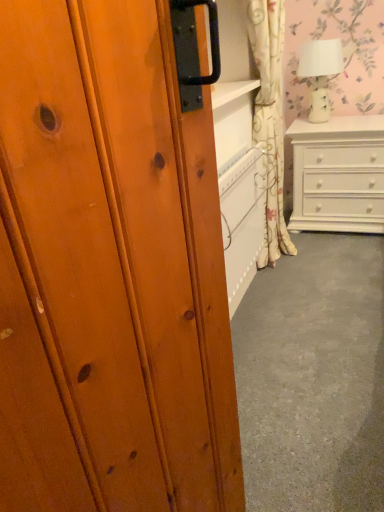
Measure the distance between white glossy chest of drawers at right and camera.

7.24 feet.

The width and height of the screenshot is (384, 512). What do you see at coordinates (270, 118) in the screenshot?
I see `floral fabric curtain at upper right` at bounding box center [270, 118].

You are a GUI agent. You are given a task and a screenshot of the screen. Output one action in this format:
    pyautogui.click(x=<x>, y=<y>)
    Task: Click on the white glossy chest of drawers at right
    This screenshot has width=384, height=512.
    Given the screenshot: What is the action you would take?
    pyautogui.click(x=338, y=174)

Which object is further away from the camera, floral fabric curtain at upper right or white ceramic lamp at upper right?

white ceramic lamp at upper right.

Based on the photo, which object is positioned more to the right, floral fabric curtain at upper right or white ceramic lamp at upper right?

white ceramic lamp at upper right is more to the right.

From the image's perspective, is floral fabric curtain at upper right positioned above or below white ceramic lamp at upper right?

Based on their image positions, floral fabric curtain at upper right is located beneath white ceramic lamp at upper right.

From a real-world perspective, is floral fabric curtain at upper right under white ceramic lamp at upper right?

Correct, in the physical world, floral fabric curtain at upper right is lower than white ceramic lamp at upper right.

From a real-world perspective, is white ceramic lamp at upper right located higher than white glossy chest of drawers at right?

Indeed, from a real-world perspective, white ceramic lamp at upper right stands above white glossy chest of drawers at right.

Is the surface of white ceramic lamp at upper right in direct contact with white glossy chest of drawers at right?

No, white ceramic lamp at upper right is not in contact with white glossy chest of drawers at right.

Between white ceramic lamp at upper right and white glossy chest of drawers at right, which one is positioned in front?

white glossy chest of drawers at right is more forward.

Between white ceramic lamp at upper right and white glossy chest of drawers at right, which one has larger width?

white glossy chest of drawers at right is wider.

Which of these two, floral fabric curtain at upper right or white glossy chest of drawers at right, is smaller?

Smaller between the two is floral fabric curtain at upper right.

Can you confirm if floral fabric curtain at upper right is positioned to the left of white glossy chest of drawers at right?

Yes.

From a real-world perspective, which object stands above the other?

floral fabric curtain at upper right.

How many degrees apart are the facing directions of floral fabric curtain at upper right and white glossy chest of drawers at right?

floral fabric curtain at upper right and white glossy chest of drawers at right are facing 89.1 degrees away from each other.

From the image's perspective, which one is positioned lower, white glossy chest of drawers at right or white ceramic lamp at upper right?

white glossy chest of drawers at right appears lower in the image.

Can you tell me how much white glossy chest of drawers at right and white ceramic lamp at upper right differ in facing direction?

white glossy chest of drawers at right and white ceramic lamp at upper right are facing 1.82 degrees away from each other.

Are white glossy chest of drawers at right and white ceramic lamp at upper right beside each other?

They are not placed beside each other.

From a real-world perspective, who is located higher, white glossy chest of drawers at right or white ceramic lamp at upper right?

In real-world perspective, white ceramic lamp at upper right is above.

From a real-world perspective, which is physically below, white glossy chest of drawers at right or floral fabric curtain at upper right?

In real-world perspective, white glossy chest of drawers at right is lower.

Does white glossy chest of drawers at right have a larger size compared to floral fabric curtain at upper right?

Answer: Correct, white glossy chest of drawers at right is larger in size than floral fabric curtain at upper right.

Does white glossy chest of drawers at right come in front of floral fabric curtain at upper right?

No, white glossy chest of drawers at right is further to the viewer.

Identify the location of the chest of drawers lying below the floral fabric curtain at upper right (from the image's perspective). (338, 174).

Which is behind, white ceramic lamp at upper right or floral fabric curtain at upper right?

white ceramic lamp at upper right is more distant.

Is white ceramic lamp at upper right beside floral fabric curtain at upper right?

white ceramic lamp at upper right is not next to floral fabric curtain at upper right, and they're not touching.

Does white ceramic lamp at upper right turn towards floral fabric curtain at upper right?

Yes, white ceramic lamp at upper right faces towards floral fabric curtain at upper right.

Can you confirm if white ceramic lamp at upper right is wider than floral fabric curtain at upper right?

Correct, the width of white ceramic lamp at upper right exceeds that of floral fabric curtain at upper right.

This screenshot has width=384, height=512. I want to click on curtain on the left of white ceramic lamp at upper right, so click(270, 118).

The width and height of the screenshot is (384, 512). What are the coordinates of `lamp above the white glossy chest of drawers at right (from the image's perspective)` in the screenshot? It's located at (320, 73).

Based on the photo, based on their spatial positions, is white glossy chest of drawers at right or white ceramic lamp at upper right further from floral fabric curtain at upper right?

white ceramic lamp at upper right lies further to floral fabric curtain at upper right than the other object.

Consider the image. Which object lies further to the anchor point white ceramic lamp at upper right, floral fabric curtain at upper right or white glossy chest of drawers at right?

Among the two, floral fabric curtain at upper right is located further to white ceramic lamp at upper right.

From the image, which object appears to be nearer to white glossy chest of drawers at right, white ceramic lamp at upper right or floral fabric curtain at upper right?

white ceramic lamp at upper right is positioned closer to the anchor white glossy chest of drawers at right.

From the image, which object appears to be farther from floral fabric curtain at upper right, white ceramic lamp at upper right or white glossy chest of drawers at right?

Based on the image, white ceramic lamp at upper right appears to be further to floral fabric curtain at upper right.

When comparing their distances from white glossy chest of drawers at right, does floral fabric curtain at upper right or white ceramic lamp at upper right seem further?

floral fabric curtain at upper right.

When comparing their distances from white ceramic lamp at upper right, does white glossy chest of drawers at right or floral fabric curtain at upper right seem further?

The object further to white ceramic lamp at upper right is floral fabric curtain at upper right.

Where is `chest of drawers between floral fabric curtain at upper right and white ceramic lamp at upper right from front to back`? The width and height of the screenshot is (384, 512). chest of drawers between floral fabric curtain at upper right and white ceramic lamp at upper right from front to back is located at coordinates (338, 174).